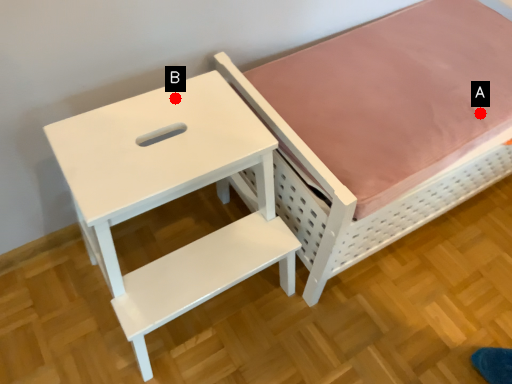
Question: Two points are circled on the image, labeled by A and B beside each circle. Which of the following is the farthest from the observer?

Choices:
 (A) A is further
 (B) B is further

Answer: (A)